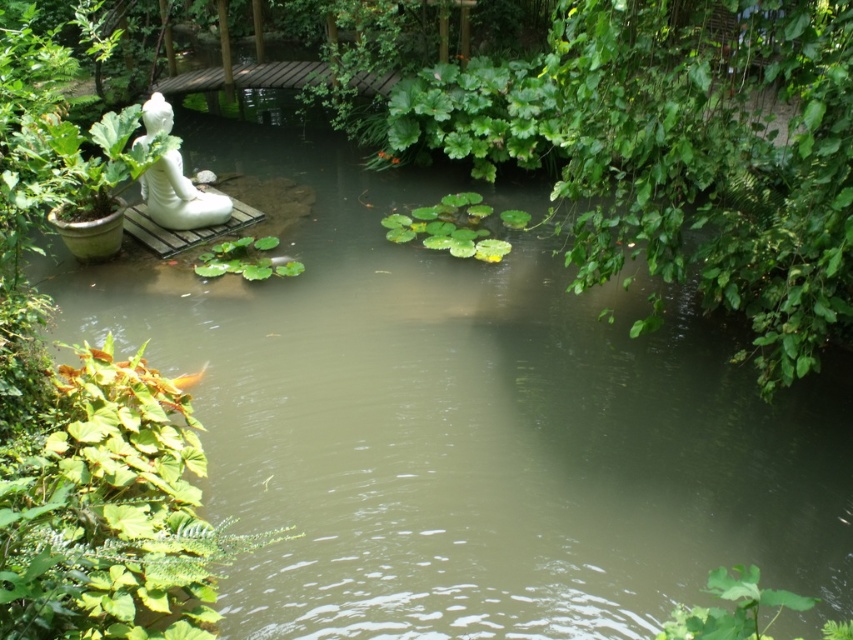
Question: Which of the following is the farthest from the observer?

Choices:
 (A) (228, 198)
 (B) (119, 452)

Answer: (A)

Question: Which of the following is the closest to the observer?

Choices:
 (A) green leafy plant at center
 (B) green leafy plant at lower left

Answer: (B)

Question: Is green leafy plant at lower left thinner than green leafy lily pads at center?

Choices:
 (A) no
 (B) yes

Answer: (B)

Question: Is green leafy lily pads at center bigger than green leafy plant at center?

Choices:
 (A) yes
 (B) no

Answer: (A)

Question: Where is green leafy lily pads at center located in relation to green leafy plant at center in the image?

Choices:
 (A) below
 (B) above

Answer: (B)

Question: Which of these objects is positioned closest to the green leafy plant at lower left?

Choices:
 (A) green leafy lily pads at center
 (B) white glossy statue at upper left
 (C) green leafy plant at center

Answer: (C)